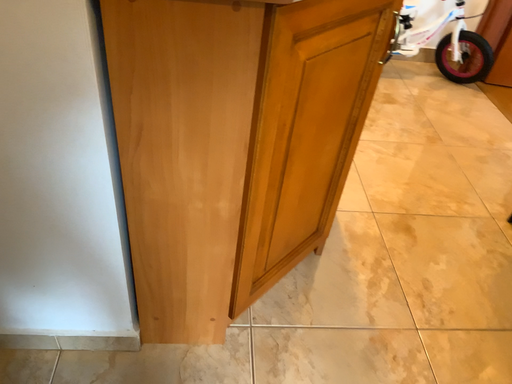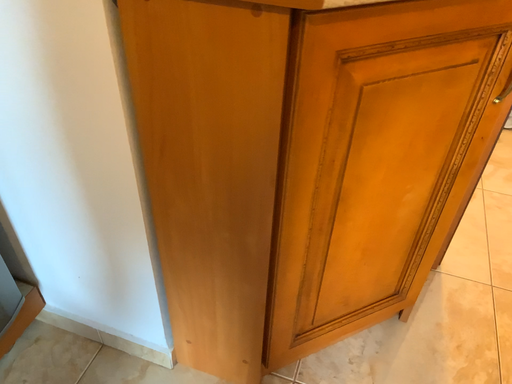
Question: Which way did the camera rotate in the video?

Choices:
 (A) rotated right
 (B) rotated left

Answer: (B)